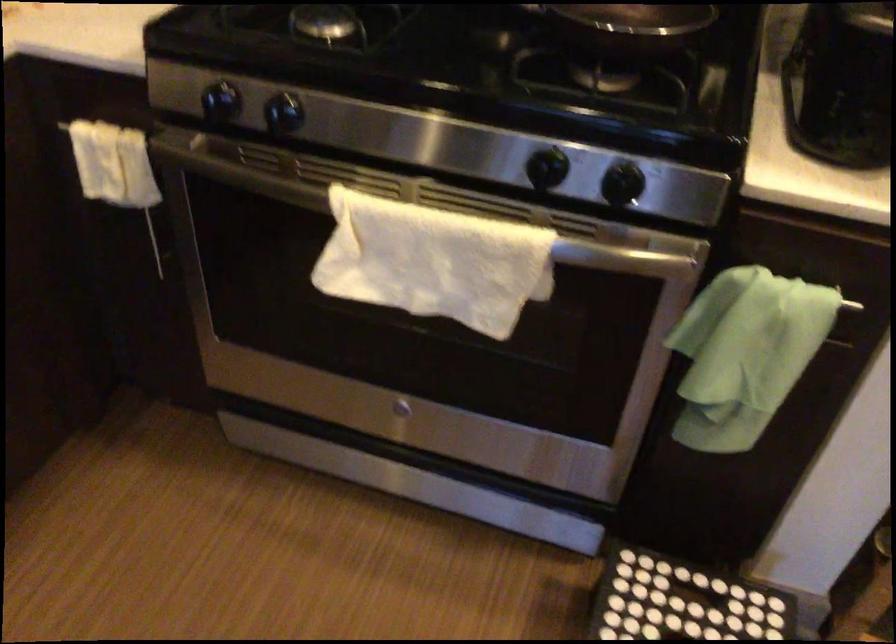
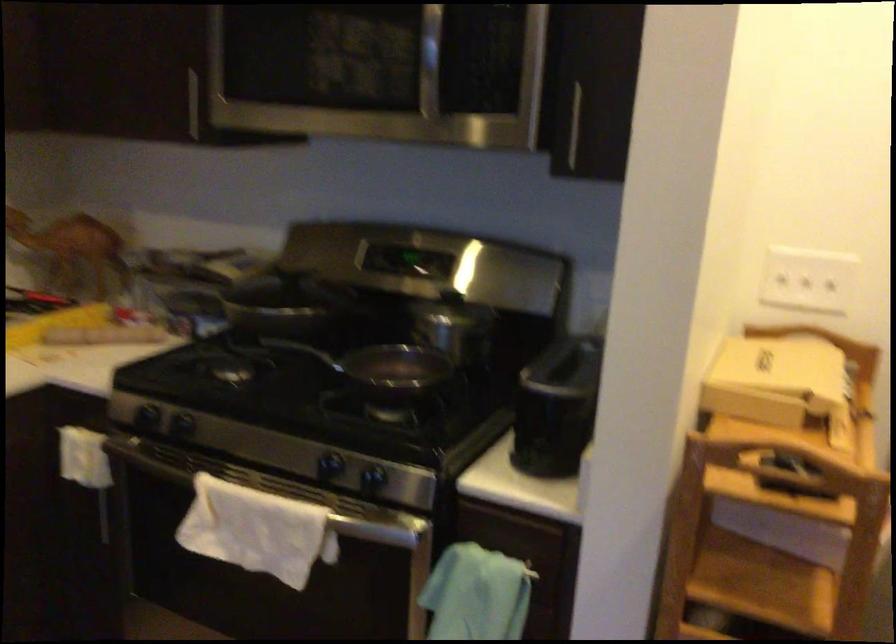
Based on the photo, the images are taken continuously from a first-person perspective. In which direction are you moving?

The movement direction of the cameraman is right, backward.